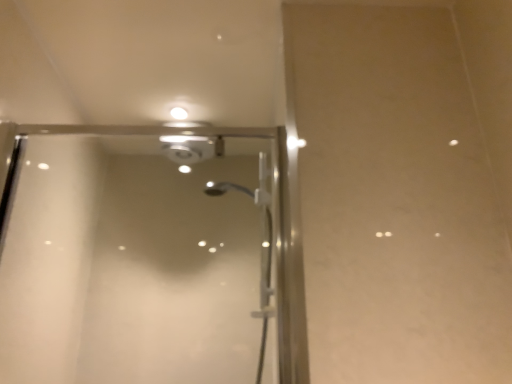
Question: Considering the relative sizes of transparent glass shower door at center and matte white droplight at upper center in the image provided, is transparent glass shower door at center smaller than matte white droplight at upper center?

Choices:
 (A) no
 (B) yes

Answer: (A)

Question: Is transparent glass shower door at center behind matte white droplight at upper center?

Choices:
 (A) yes
 (B) no

Answer: (B)

Question: Can you confirm if transparent glass shower door at center is thinner than matte white droplight at upper center?

Choices:
 (A) no
 (B) yes

Answer: (A)

Question: Does transparent glass shower door at center have a greater height compared to matte white droplight at upper center?

Choices:
 (A) yes
 (B) no

Answer: (A)

Question: Can you confirm if transparent glass shower door at center is positioned to the right of matte white droplight at upper center?

Choices:
 (A) no
 (B) yes

Answer: (B)

Question: Considering the relative sizes of transparent glass shower door at center and matte white droplight at upper center in the image provided, is transparent glass shower door at center wider than matte white droplight at upper center?

Choices:
 (A) no
 (B) yes

Answer: (B)

Question: Is matte white droplight at upper center not near transparent glass shower door at center?

Choices:
 (A) yes
 (B) no

Answer: (B)

Question: Does matte white droplight at upper center have a smaller size compared to transparent glass shower door at center?

Choices:
 (A) yes
 (B) no

Answer: (A)

Question: Is matte white droplight at upper center taller than transparent glass shower door at center?

Choices:
 (A) no
 (B) yes

Answer: (A)

Question: Is matte white droplight at upper center turned away from transparent glass shower door at center?

Choices:
 (A) no
 (B) yes

Answer: (A)

Question: Is the position of matte white droplight at upper center less distant than that of transparent glass shower door at center?

Choices:
 (A) yes
 (B) no

Answer: (B)

Question: Can you confirm if matte white droplight at upper center is thinner than transparent glass shower door at center?

Choices:
 (A) no
 (B) yes

Answer: (B)

Question: Is point (256, 291) closer or farther from the camera than point (182, 112)?

Choices:
 (A) farther
 (B) closer

Answer: (A)